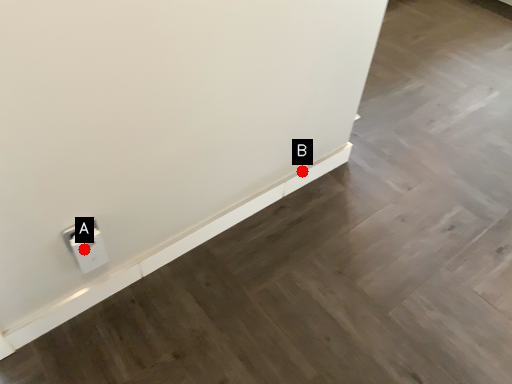
Question: Two points are circled on the image, labeled by A and B beside each circle. Which point appears farthest from the camera in this image?

Choices:
 (A) A is further
 (B) B is further

Answer: (B)